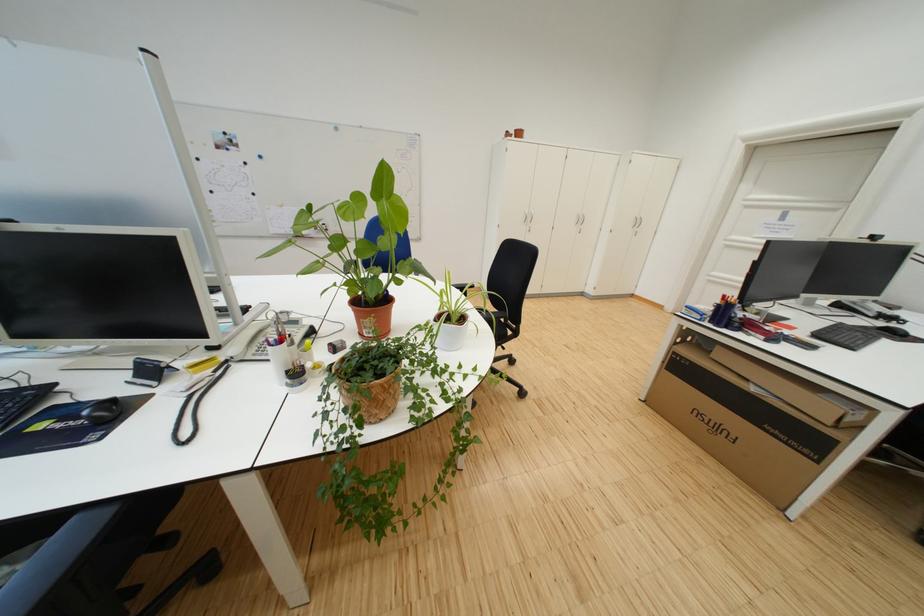
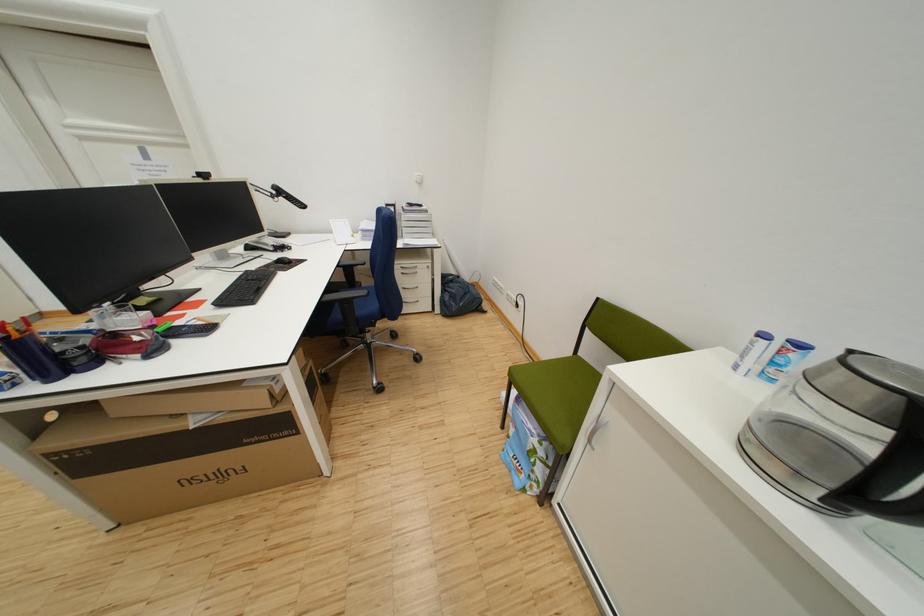
First-person continuous shooting, in which direction is the camera rotating?

The rotation direction of the camera is right-down.